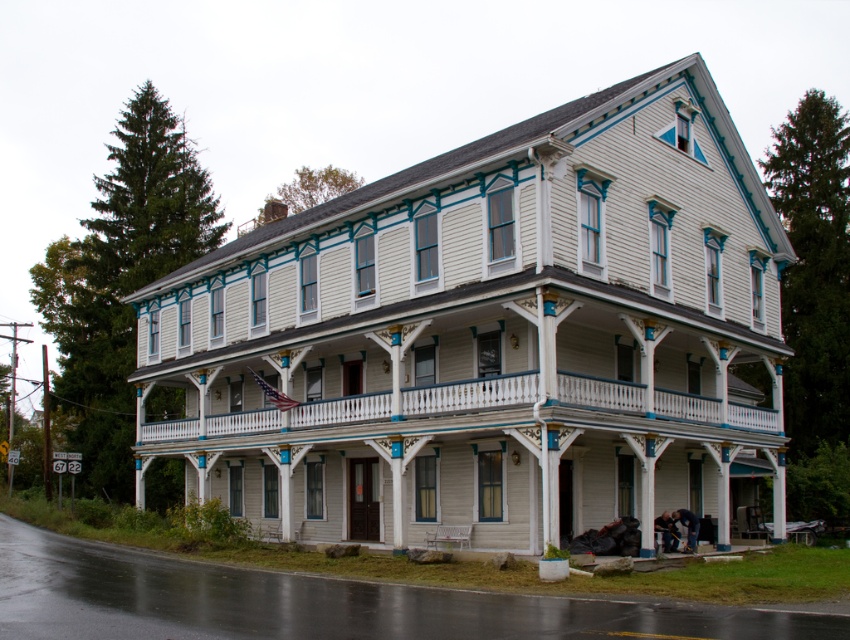
Question: Which object appears closest to the camera in this image?

Choices:
 (A) white painted wood porch at center
 (B) white wood building at center

Answer: (B)

Question: Which point appears farthest from the camera in this image?

Choices:
 (A) (442, 205)
 (B) (565, 390)

Answer: (A)

Question: Is white wood building at center wider than white painted wood porch at center?

Choices:
 (A) no
 (B) yes

Answer: (B)

Question: Can you confirm if white wood building at center is positioned to the left of white painted wood porch at center?

Choices:
 (A) no
 (B) yes

Answer: (B)

Question: Does white wood building at center appear under white painted wood porch at center?

Choices:
 (A) yes
 (B) no

Answer: (B)